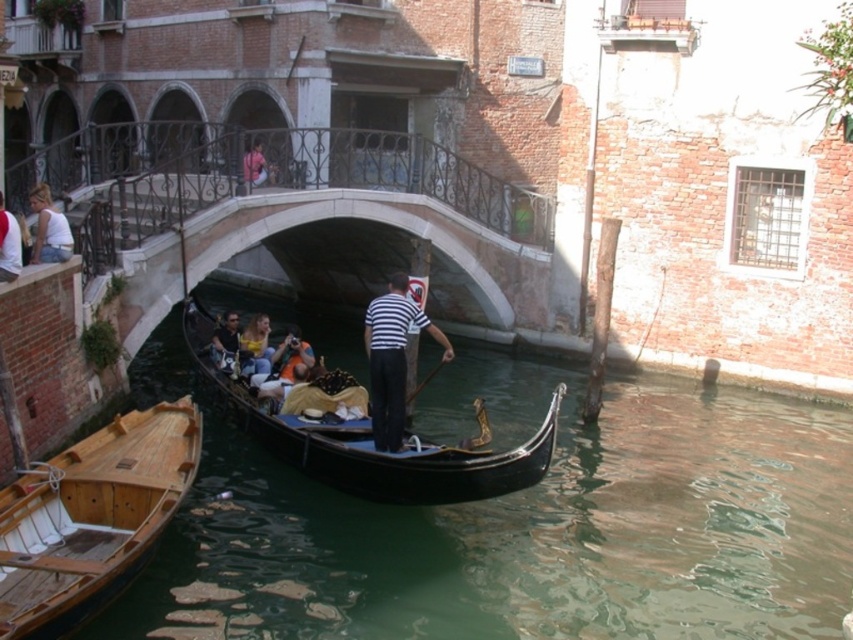
Question: From the image, what is the correct spatial relationship of wooden boat at lower left in relation to striped cotton shirt at center?

Choices:
 (A) below
 (B) above

Answer: (A)

Question: Among these points, which one is farthest from the camera?

Choices:
 (A) (44, 216)
 (B) (381, 346)
 (C) (265, 333)
 (D) (784, 499)

Answer: (C)

Question: Where is wooden boat at lower left located in relation to white cotton shirt at left in the image?

Choices:
 (A) below
 (B) above

Answer: (A)

Question: Which of the following is the farthest from the observer?

Choices:
 (A) (10, 216)
 (B) (256, 364)
 (C) (215, 374)

Answer: (B)

Question: Can you confirm if wooden boat at lower left is positioned to the right of shiny black gondola at center?

Choices:
 (A) yes
 (B) no

Answer: (B)

Question: Which object is the farthest from the striped cotton shirt at center?

Choices:
 (A) white cotton shirt at left
 (B) shiny black gondola at center
 (C) wooden boat at lower left
 (D) yellow fabric at center

Answer: (A)